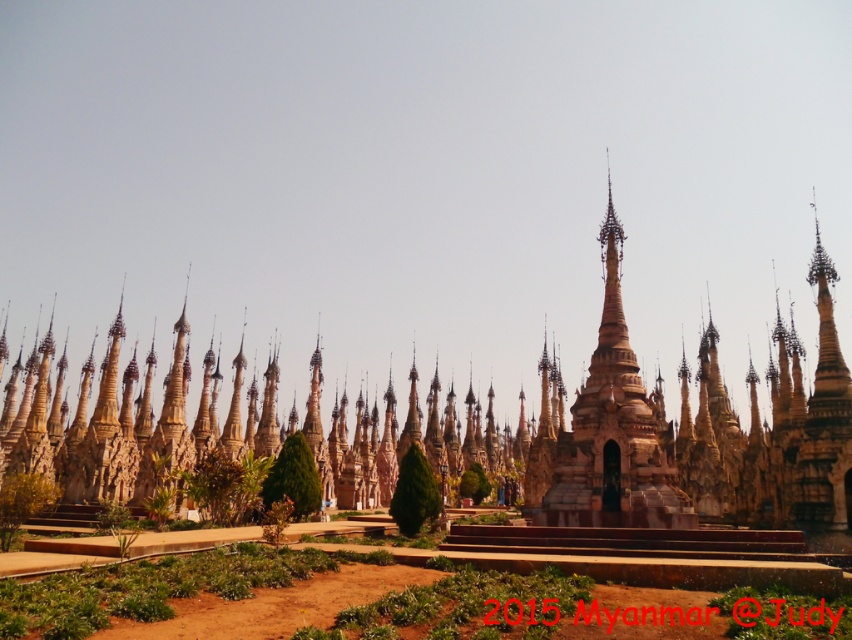
Who is lower down, brown stone pagoda at center or golden polished stupa at center?

Positioned lower is golden polished stupa at center.

Does brown stone pagoda at center have a larger size compared to golden polished stupa at center?

Correct, brown stone pagoda at center is larger in size than golden polished stupa at center.

Is point (331, 468) positioned behind point (593, 381)?

Yes, point (331, 468) is farther from viewer.

Image resolution: width=852 pixels, height=640 pixels. I want to click on brown stone pagoda at center, so click(626, 429).